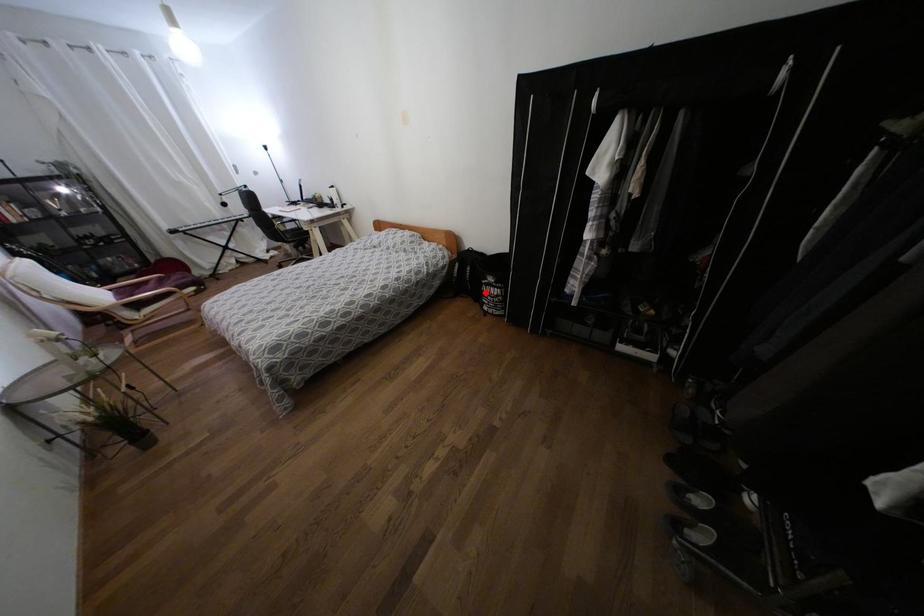
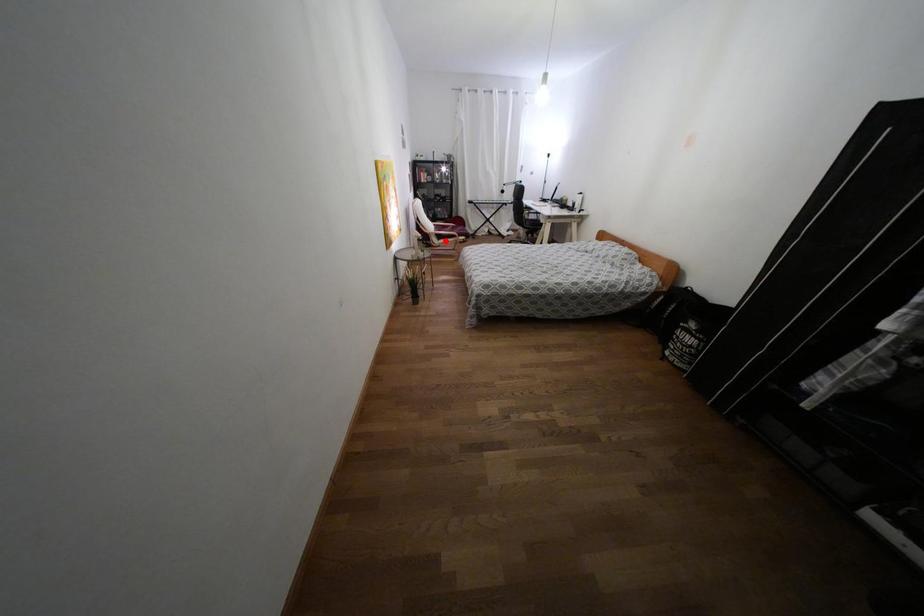
I am providing you with two images of the same scene from different viewpoints. A red point is marked on the first image and another point is marked on the second image. Do the highlighted points in image1 and image2 indicate the same real-world spot?

No